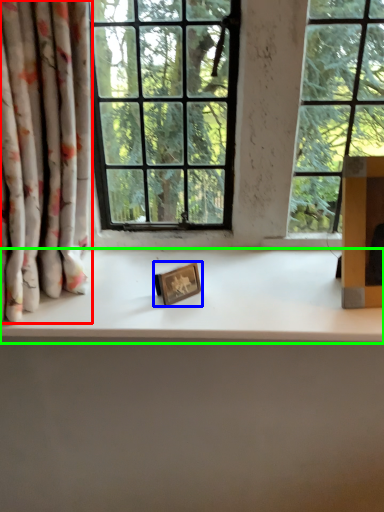
Question: Based on their relative distances, which object is nearer to curtain (highlighted by a red box)? Choose from picture frame (highlighted by a blue box) and counter top (highlighted by a green box).

Choices:
 (A) picture frame
 (B) counter top

Answer: (B)